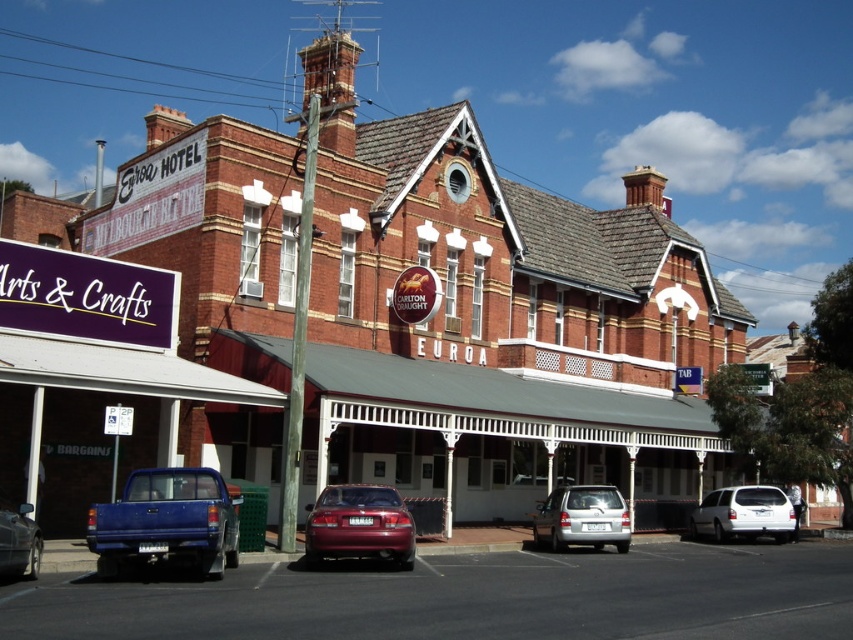
You are a pedestrian standing in front of the Euroa Hotel and want to cross the street. There are two vehicles in view, the blue metallic truck at lower left and the silver metallic hatchback at center. Which vehicle should you look towards first to check for oncoming traffic?

You should look towards the blue metallic truck at lower left first because it is positioned to the left of the silver metallic hatchback at center, meaning it is closer to your left side when facing the street.

You are a delivery driver who needs to park your truck which is as wide as the silver metallic hatchback at center. The parking spot in front of the Euroa Hotel is under the white painted wood awning at center. Will your truck fit widthwise in this parking spot?

The white painted wood awning at center is wider than the silver metallic hatchback at center, so the parking spot under the awning should be wide enough to accommodate your truck since it is as wide as the hatchback.